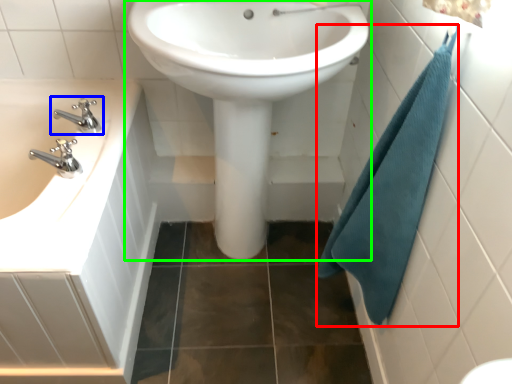
Question: Which is farther away from bath towel (highlighted by a red box)? tap (highlighted by a blue box) or sink (highlighted by a green box)?

Choices:
 (A) tap
 (B) sink

Answer: (A)